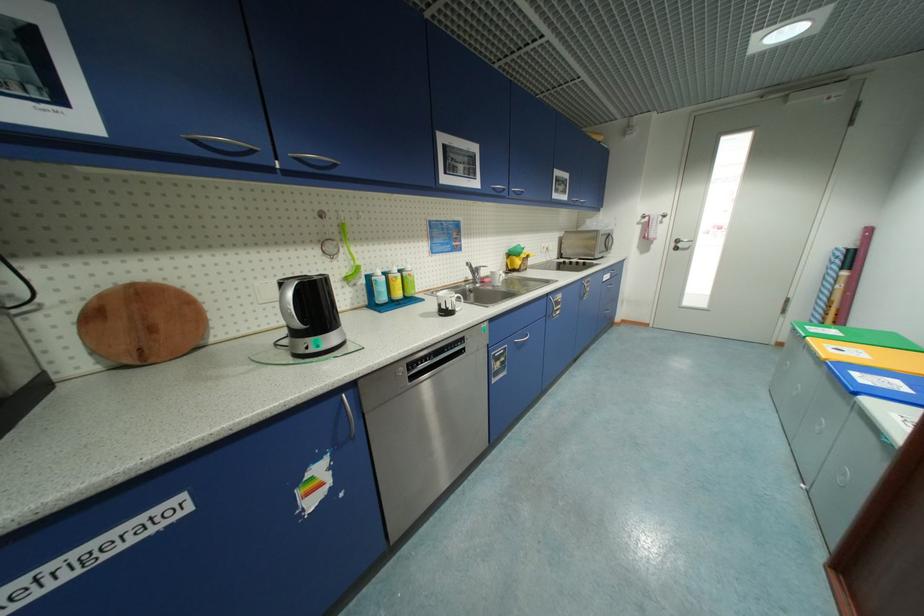
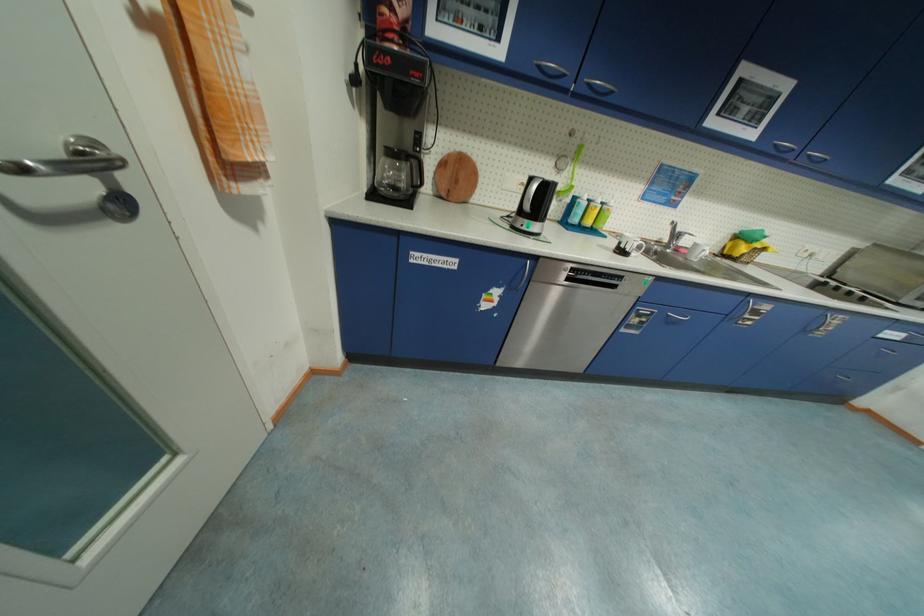
Where in the second image is the point corresponding to [114,286] from the first image?

(457, 151)